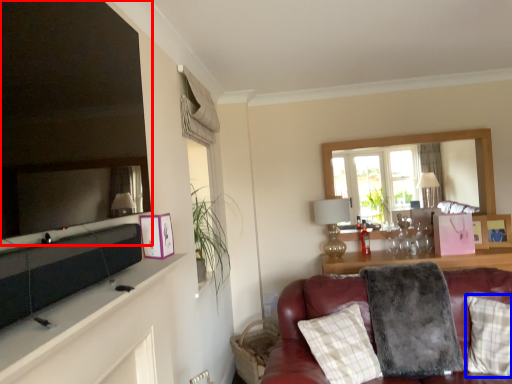
Question: Which point is further to the camera, mirror (highlighted by a red box) or pillow (highlighted by a blue box)?

Choices:
 (A) mirror
 (B) pillow

Answer: (B)